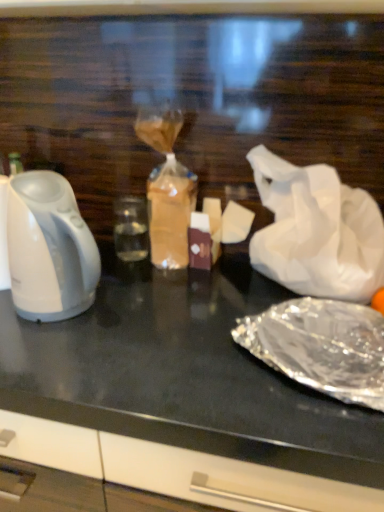
Locate an element on the screen. white crumpled paper at right is located at coordinates (316, 231).

This screenshot has height=512, width=384. What do you see at coordinates (183, 373) in the screenshot?
I see `black glossy table at center` at bounding box center [183, 373].

Looking at this image, measure the distance between point (x=203, y=288) and camera.

Point (x=203, y=288) and camera are 37.95 inches apart.

Where is `shiny metallic foil at lower right`? This screenshot has width=384, height=512. shiny metallic foil at lower right is located at coordinates (321, 347).

Looking at this image, which object is thinner, white crumpled paper at right or black glossy table at center?

white crumpled paper at right is thinner.

Image resolution: width=384 pixels, height=512 pixels. In order to click on table top below the white crumpled paper at right (from a real-world perspective) in this screenshot , I will do `click(183, 373)`.

From the image's perspective, relative to black glossy table at center, is white crumpled paper at right above or below?

white crumpled paper at right is situated higher than black glossy table at center in the image.

Looking at this image, between white crumpled paper at right and white glossy kettle at left, which one has less height?

With less height is white glossy kettle at left.

Between white crumpled paper at right and white glossy kettle at left, which one has smaller size?

white glossy kettle at left.

What's the angular difference between white glossy kettle at left and shiny metallic foil at lower right's facing directions?

The angle between the facing direction of white glossy kettle at left and the facing direction of shiny metallic foil at lower right is 0.00118 degrees.

Could shiny metallic foil at lower right be considered to be inside white glossy kettle at left?

Actually, shiny metallic foil at lower right is outside white glossy kettle at left.

Could you tell me if white glossy kettle at left is turned towards shiny metallic foil at lower right?

No, white glossy kettle at left is not oriented towards shiny metallic foil at lower right.

Are white glossy kettle at left and shiny metallic foil at lower right making contact?

There is a gap between white glossy kettle at left and shiny metallic foil at lower right.

Is white glossy kettle at left oriented towards white crumpled paper at right?

No, white glossy kettle at left is not oriented towards white crumpled paper at right.

Considering the positions of objects white glossy kettle at left and white crumpled paper at right in the image provided, who is more to the left, white glossy kettle at left or white crumpled paper at right?

Positioned to the left is white glossy kettle at left.

Is there a large distance between white glossy kettle at left and white crumpled paper at right?

They are positioned close to each other.

Is white glossy kettle at left completely or partially outside of white crumpled paper at right?

white glossy kettle at left lies outside white crumpled paper at right's area.

Is shiny metallic foil at lower right wider than black glossy table at center?

Incorrect, the width of shiny metallic foil at lower right does not surpass that of black glossy table at center.

Consider the image. Which is closer to the camera, (264, 356) or (278, 386)?

Point (278, 386)

Looking at this image, considering the sizes of objects shiny metallic foil at lower right and black glossy table at center in the image provided, who is shorter, shiny metallic foil at lower right or black glossy table at center?

shiny metallic foil at lower right is shorter.

Considering the sizes of objects white glossy kettle at left and black glossy table at center in the image provided, who is smaller, white glossy kettle at left or black glossy table at center?

white glossy kettle at left.

How different are the orientations of white glossy kettle at left and black glossy table at center in degrees?

0.000962 degrees.

Locate an element on the screen. This screenshot has width=384, height=512. table top that is in front of the white glossy kettle at left is located at coordinates (183, 373).

Which is more to the left, white glossy kettle at left or black glossy table at center?

From the viewer's perspective, white glossy kettle at left appears more on the left side.

Is shiny metallic foil at lower right closer to the viewer compared to white glossy kettle at left?

Yes, shiny metallic foil at lower right is in front of white glossy kettle at left.

Would you consider shiny metallic foil at lower right to be distant from white glossy kettle at left?

They are positioned close to each other.

Does shiny metallic foil at lower right have a larger size compared to white glossy kettle at left?

Actually, shiny metallic foil at lower right might be smaller than white glossy kettle at left.

How different are the orientations of shiny metallic foil at lower right and white glossy kettle at left in degrees?

0.00118 degrees separate the facing orientations of shiny metallic foil at lower right and white glossy kettle at left.

Locate an element on the screen. table top located on the left of white crumpled paper at right is located at coordinates (183, 373).

At what (x,y) coordinates should I click in order to perform the action: click on kettle that is below the white crumpled paper at right (from the image's perspective). Please return your answer as a coordinate pair (x, y). The width and height of the screenshot is (384, 512). Looking at the image, I should click on (49, 249).

When comparing their distances from black glossy table at center, does white glossy kettle at left or white crumpled paper at right seem further?

white crumpled paper at right.

Based on their spatial positions, is white crumpled paper at right or shiny metallic foil at lower right closer to white glossy kettle at left?

shiny metallic foil at lower right is closer to white glossy kettle at left.

Which object lies further to the anchor point white crumpled paper at right, shiny metallic foil at lower right or black glossy table at center?

Among the two, black glossy table at center is located further to white crumpled paper at right.

Considering their positions, is white glossy kettle at left positioned closer to white crumpled paper at right than black glossy table at center?

black glossy table at center is closer to white crumpled paper at right.

Based on their spatial positions, is white crumpled paper at right or black glossy table at center closer to white glossy kettle at left?

black glossy table at center.

Based on their spatial positions, is black glossy table at center or shiny metallic foil at lower right further from white crumpled paper at right?

black glossy table at center is further to white crumpled paper at right.

From the image, which object appears to be farther from white crumpled paper at right, shiny metallic foil at lower right or white glossy kettle at left?

white glossy kettle at left is positioned further to the anchor white crumpled paper at right.

Based on their spatial positions, is black glossy table at center or white crumpled paper at right further from white glossy kettle at left?

white crumpled paper at right lies further to white glossy kettle at left than the other object.

You are a GUI agent. You are given a task and a screenshot of the screen. Output one action in this format:
    pyautogui.click(x=<x>, y=<y>)
    Task: Click on the food between white crumpled paper at right and black glossy table at center from top to bottom
    
    Given the screenshot: What is the action you would take?
    pyautogui.click(x=321, y=347)

Identify the location of kettle that lies between white crumpled paper at right and black glossy table at center from top to bottom. Image resolution: width=384 pixels, height=512 pixels. (49, 249).

Locate an element on the screen. Image resolution: width=384 pixels, height=512 pixels. food that lies between white glossy kettle at left and black glossy table at center from top to bottom is located at coordinates (321, 347).

The image size is (384, 512). Identify the location of plastic bag between white glossy kettle at left and shiny metallic foil at lower right from left to right. (316, 231).